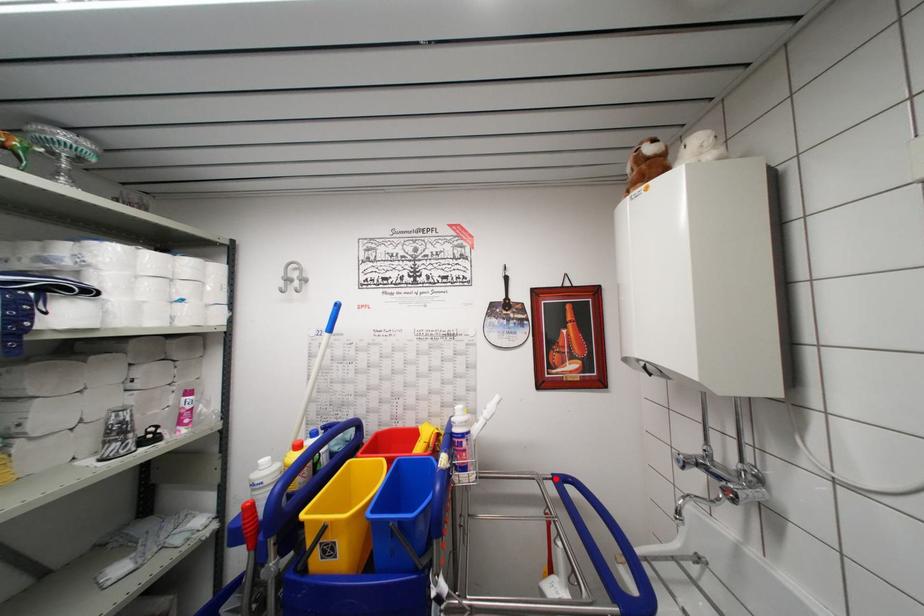
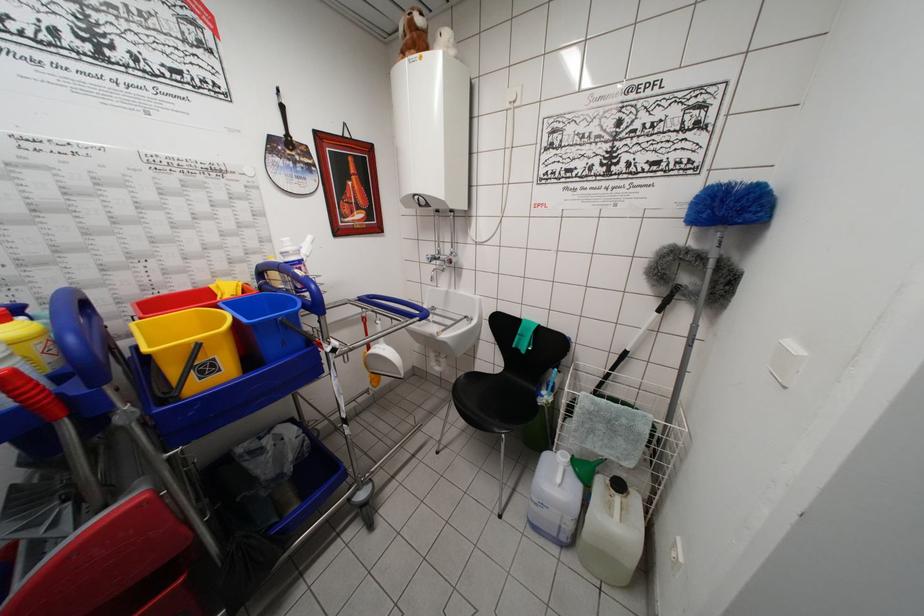
Locate, in the second image, the point that corresponds to the highlighted location in the first image.

(360, 302)